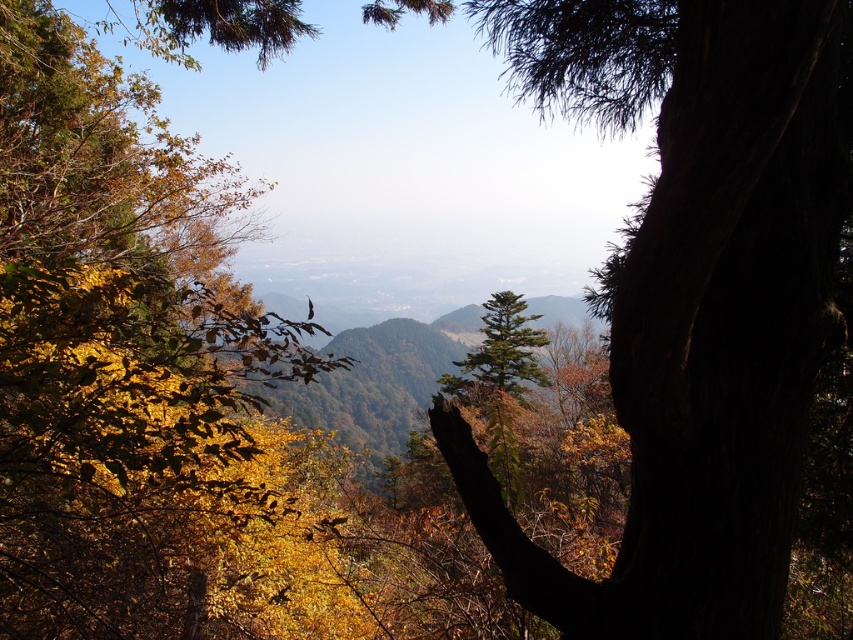
Who is higher up, dark green textured tree trunk at center or green matte tree at upper left?

dark green textured tree trunk at center

Does point (689, 518) come behind point (61, 240)?

No, (689, 518) is closer to viewer.

At what (x,y) coordinates should I click in order to perform the action: click on dark green textured tree trunk at center. Please return your answer as a coordinate pair (x, y). Looking at the image, I should click on (693, 296).